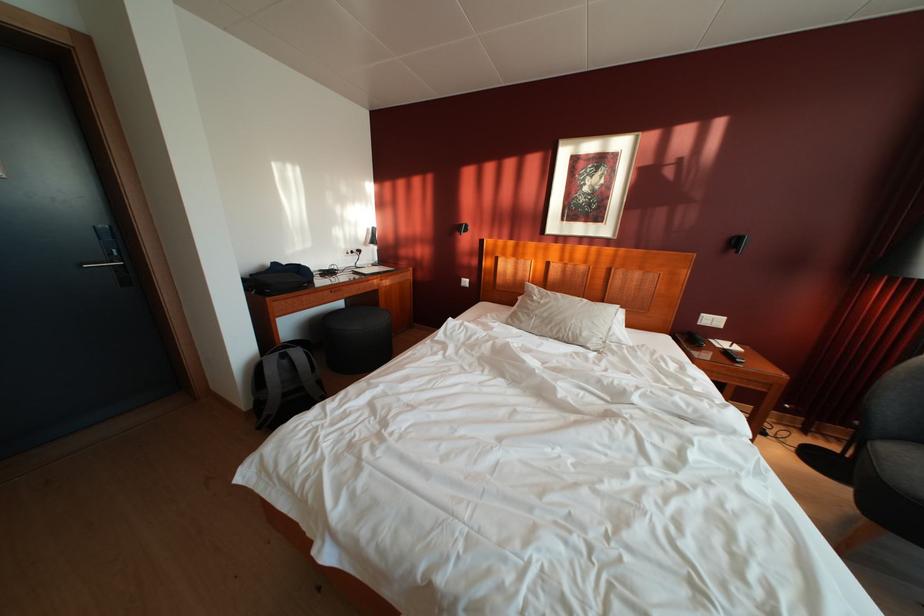
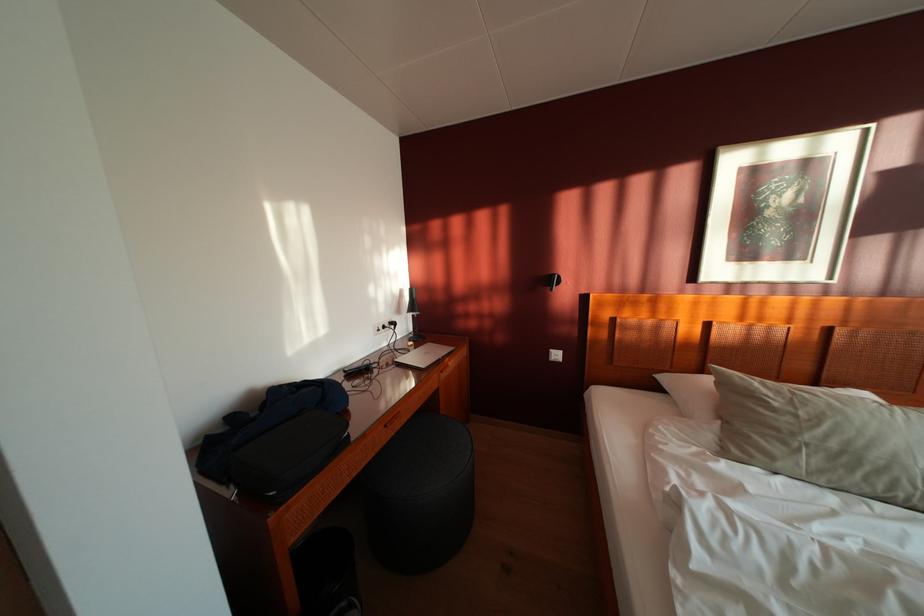
Find the pixel in the second image that matches pixel 468 286 in the first image.

(555, 360)